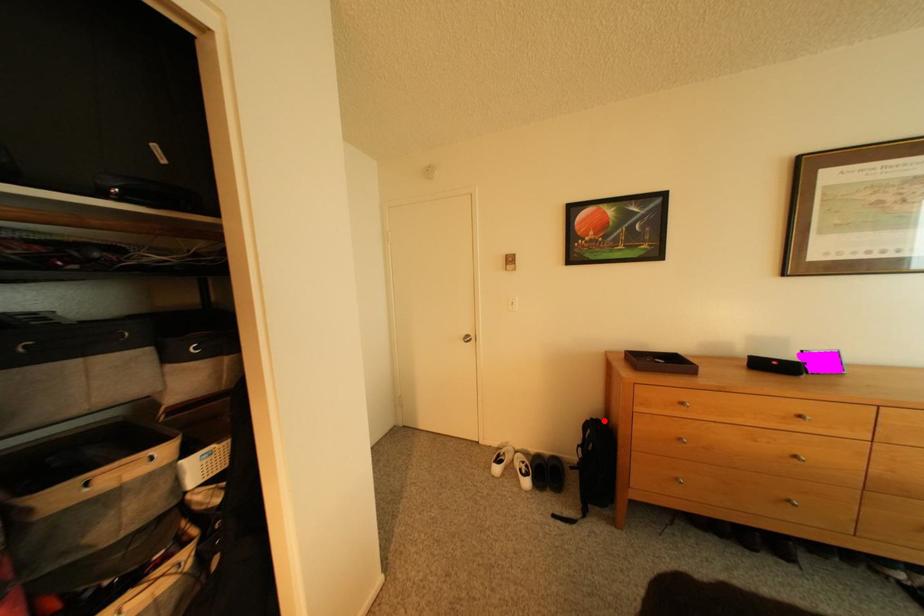
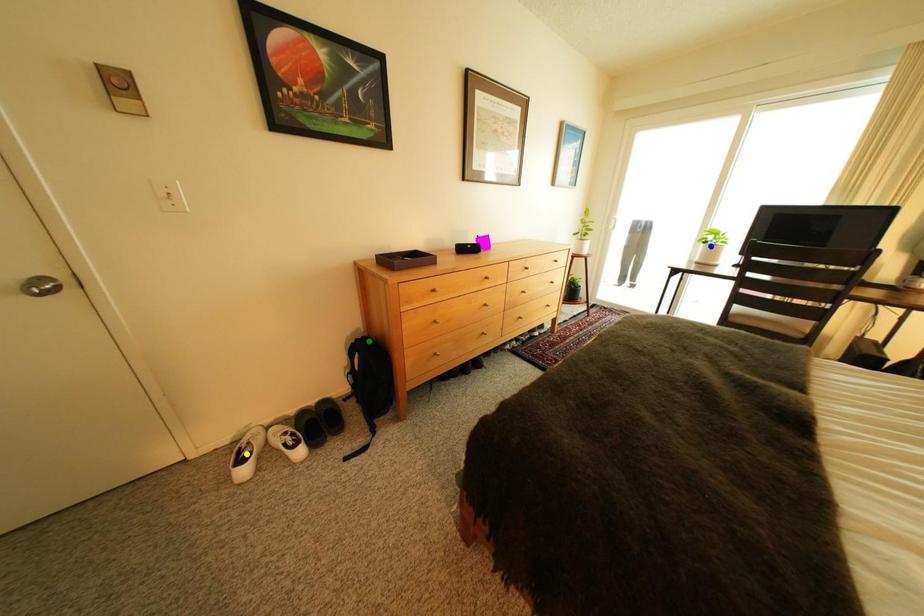
Question: I am providing you with two images of the same scene from different viewpoints. A red point is marked on the first image. You are given multiple points on the second image. Which mark in image 2 goes with the point in image 1?

Choices:
 (A) green point
 (B) blue point
 (C) yellow point

Answer: (A)